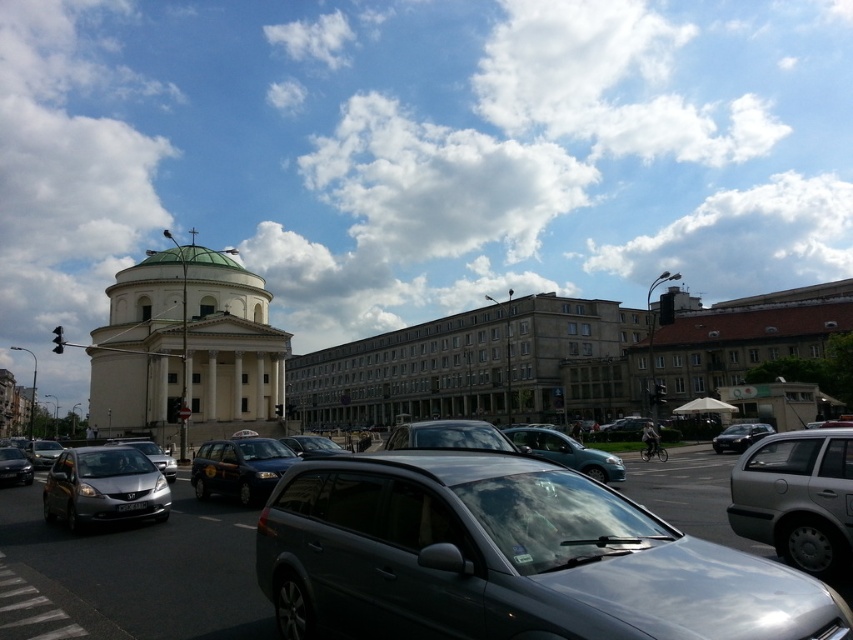
Question: Does shiny silver sedan at lower left appear under silver metallic sedan at lower left?

Choices:
 (A) yes
 (B) no

Answer: (B)

Question: Is metallic silver sedan at center-right positioned at the back of silver metallic sedan at lower left?

Choices:
 (A) yes
 (B) no

Answer: (A)

Question: From the image, what is the correct spatial relationship of metallic silver sedan at center-right in relation to satin silver sedan at lower left?

Choices:
 (A) below
 (B) above

Answer: (B)

Question: Which of the following is the closest to the observer?

Choices:
 (A) (250, 468)
 (B) (726, 444)
 (C) (140, 444)

Answer: (A)

Question: Based on their relative distances, which object is farther from the metallic silver car at center?

Choices:
 (A) satin silver sedan at lower left
 (B) shiny silver sedan at lower left

Answer: (A)

Question: Which of the following is the farthest from the observer?

Choices:
 (A) (804, 572)
 (B) (80, 497)

Answer: (B)